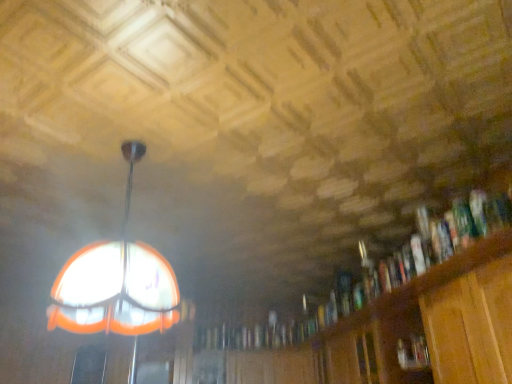
Question: In terms of width, does wooden cabinet at lower right look wider or thinner when compared to translucent glass dome at upper left?

Choices:
 (A) thin
 (B) wide

Answer: (A)

Question: Considering the positions of point (282, 380) and point (70, 319), is point (282, 380) closer or farther from the camera than point (70, 319)?

Choices:
 (A) closer
 (B) farther

Answer: (B)

Question: Which object is positioned farthest from the wooden bookcase at right?

Choices:
 (A) hardcover book at right
 (B) wooden cabinet at lower right
 (C) translucent glass dome at upper left

Answer: (C)

Question: Considering the real-world distances, which object is farthest from the hardcover book at right?

Choices:
 (A) wooden cabinet at lower right
 (B) translucent glass dome at upper left
 (C) wooden bookcase at right

Answer: (A)